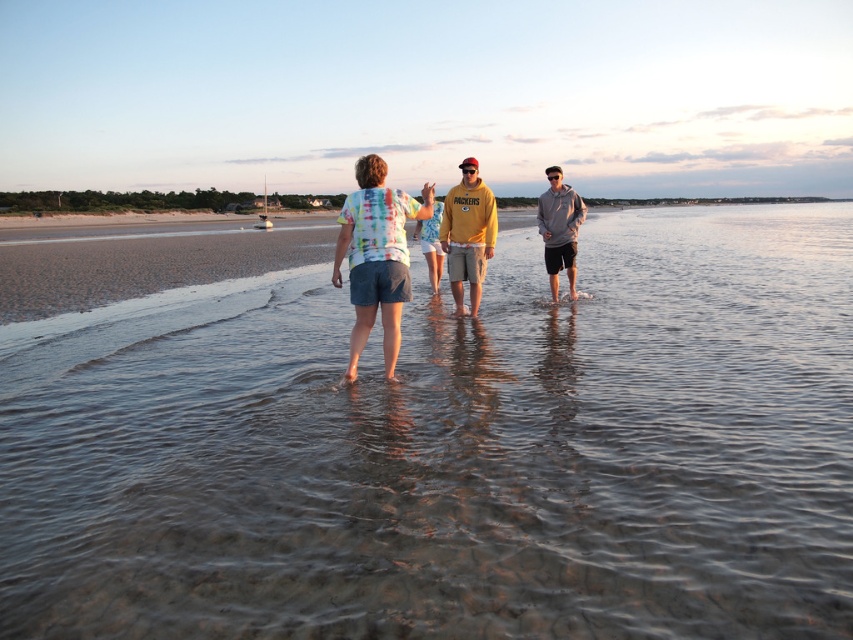
Question: Does clear water at center appear on the left side of yellow fleece at center?

Choices:
 (A) yes
 (B) no

Answer: (B)

Question: Considering the real-world distances, which object is closest to the clear water at center?

Choices:
 (A) yellow fleece at center
 (B) tie-dye fabric shirt at center

Answer: (A)

Question: Where is clear water at center located in relation to gray hoodie at center in the image?

Choices:
 (A) below
 (B) above

Answer: (A)

Question: Among these objects, which one is farthest from the camera?

Choices:
 (A) gray hoodie at center
 (B) yellow fleece at center
 (C) tie-dye fabric shirt at center
 (D) clear water at center

Answer: (A)

Question: Does tie-dye fabric shirt at center appear on the left side of gray hoodie at center?

Choices:
 (A) yes
 (B) no

Answer: (A)

Question: Which point appears farthest from the camera in this image?

Choices:
 (A) (488, 234)
 (B) (368, 237)

Answer: (A)